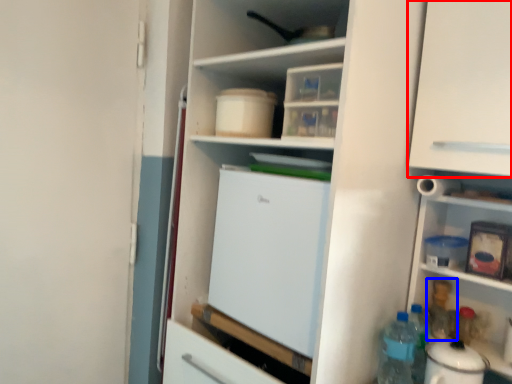
Question: Which point is closer to the camera, cabinetry (highlighted by a red box) or bottle (highlighted by a blue box)?

Choices:
 (A) cabinetry
 (B) bottle

Answer: (A)